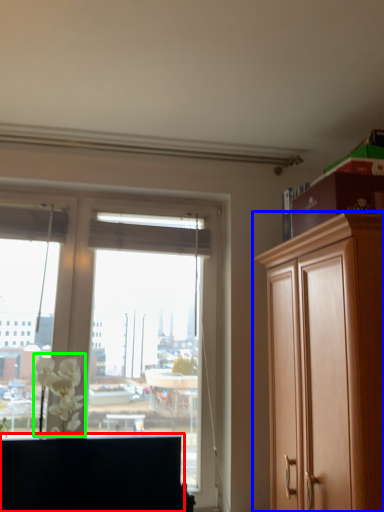
Question: Estimate the real-world distances between objects in this image. Which object is farther from cabinetry (highlighted by a red box), cabinetry (highlighted by a blue box) or flower (highlighted by a green box)?

Choices:
 (A) cabinetry
 (B) flower

Answer: (A)